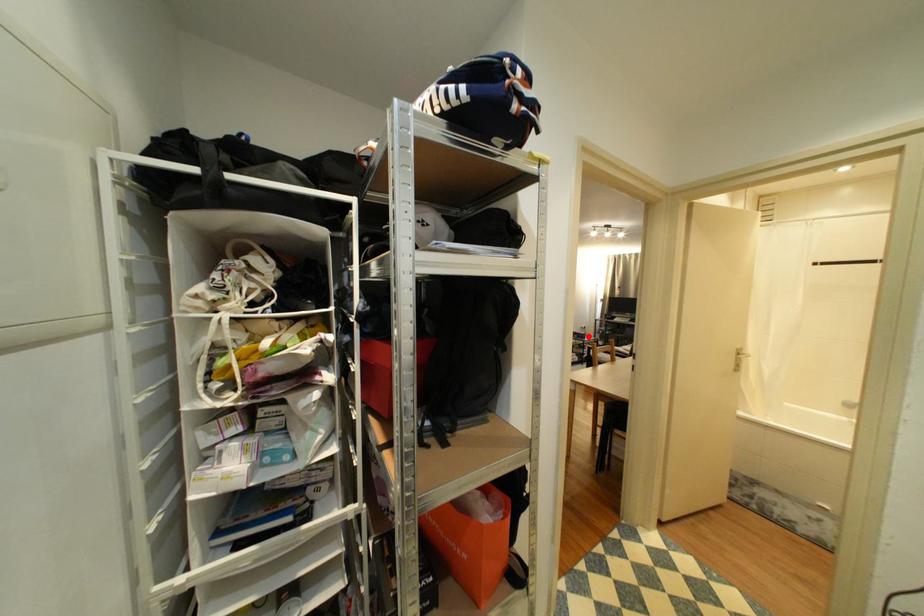
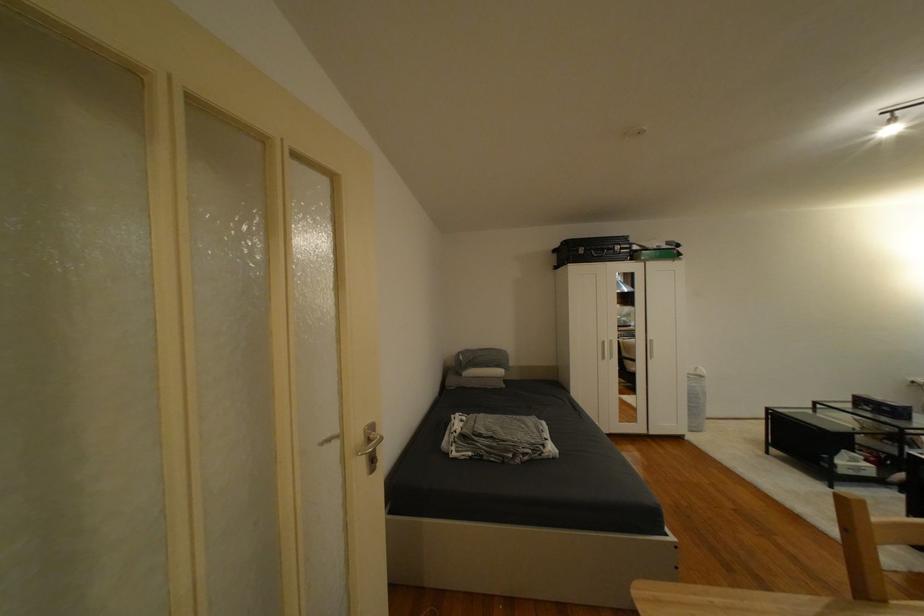
Question: I am providing you with two images of the same scene from different viewpoints. A red point is shown in image1. For the corresponding object point in image2, is it positioned nearer or farther from the camera?

Choices:
 (A) Nearer
 (B) Farther

Answer: (A)